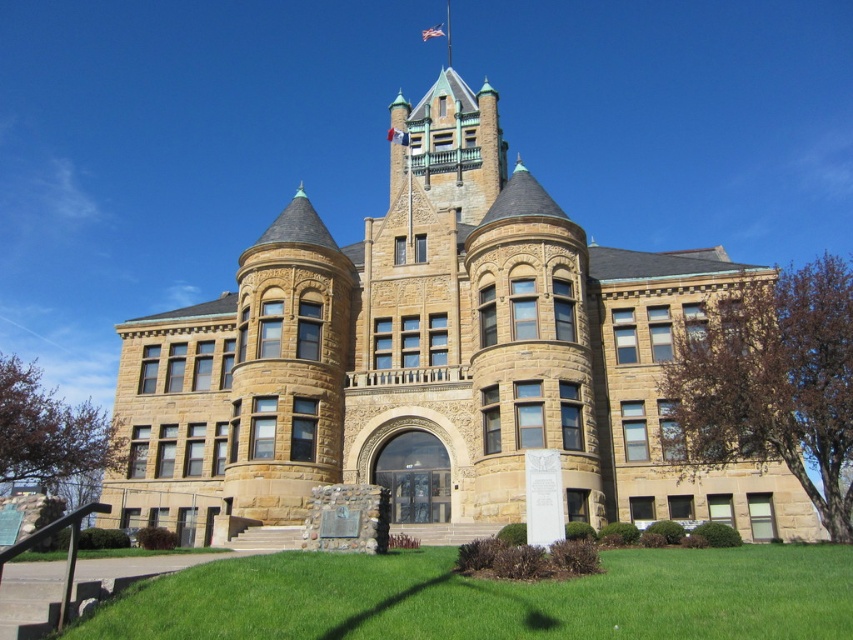
Question: In this image, where is brown stone tower at center located relative to green grass at lower center?

Choices:
 (A) above
 (B) below

Answer: (A)

Question: Which of the following is the closest to the observer?

Choices:
 (A) green grass at lower center
 (B) brown stone tower at center

Answer: (A)

Question: Which of the following is the farthest from the observer?

Choices:
 (A) (744, 557)
 (B) (498, 237)

Answer: (B)

Question: Does brown stone tower at center appear over green grass at lower center?

Choices:
 (A) no
 (B) yes

Answer: (B)

Question: Does brown stone tower at center appear over green grass at lower center?

Choices:
 (A) no
 (B) yes

Answer: (B)